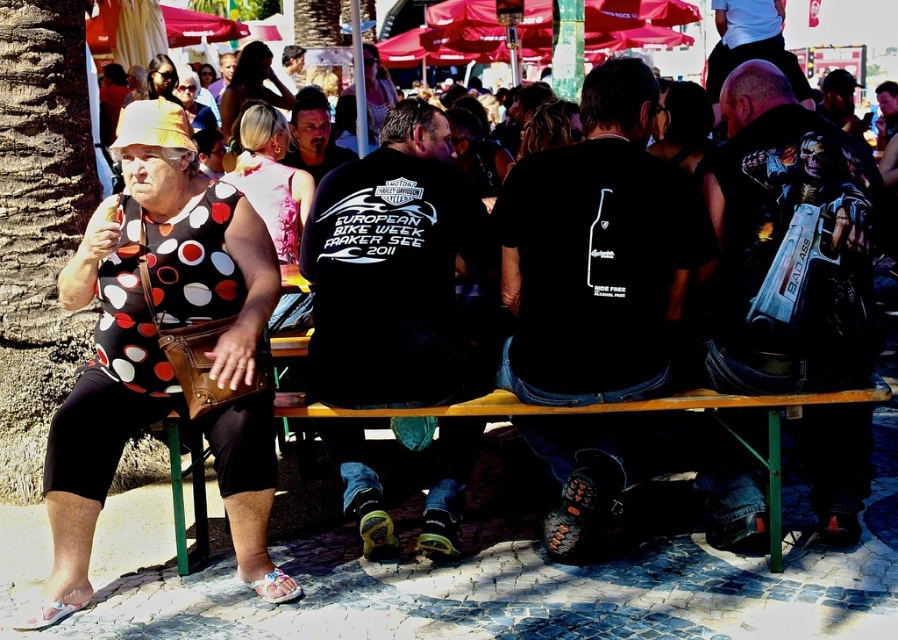
You are an artist trying to sketch the scene. You notice the polka dot fabric dress at left and the blonde hair at upper center. Which object should you draw first if you want to focus on the larger one first?

The polka dot fabric dress at left should be drawn first because it has a larger size compared to the blonde hair at upper center.

You are a fashion designer observing the scene and want to create a new dress design. Which dress, the polka dot fabric dress at left or the polka dot fabric dress at upper left, should you choose if you want a wider silhouette for your design?

The polka dot fabric dress at left has a larger width than the polka dot fabric dress at upper left, making it the better choice for a wider silhouette.